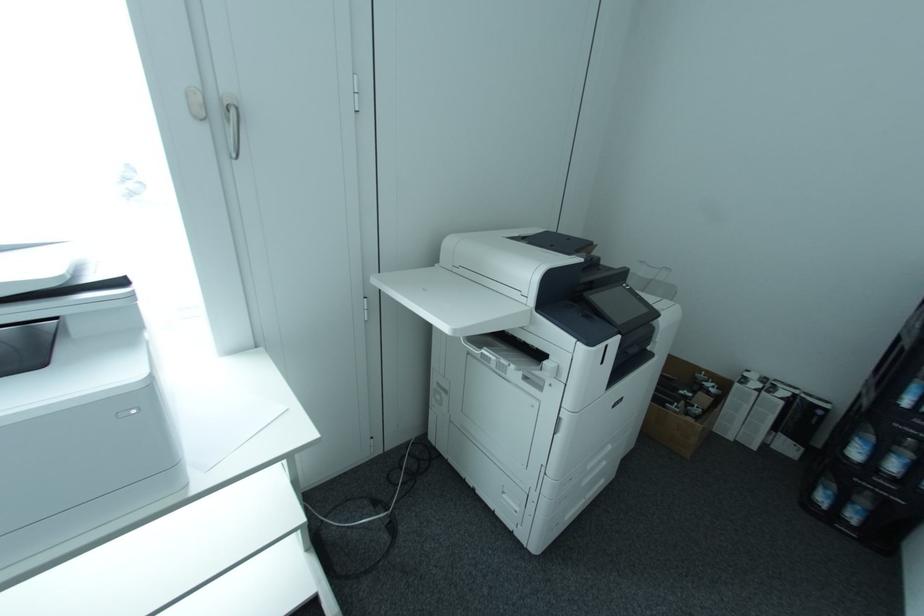
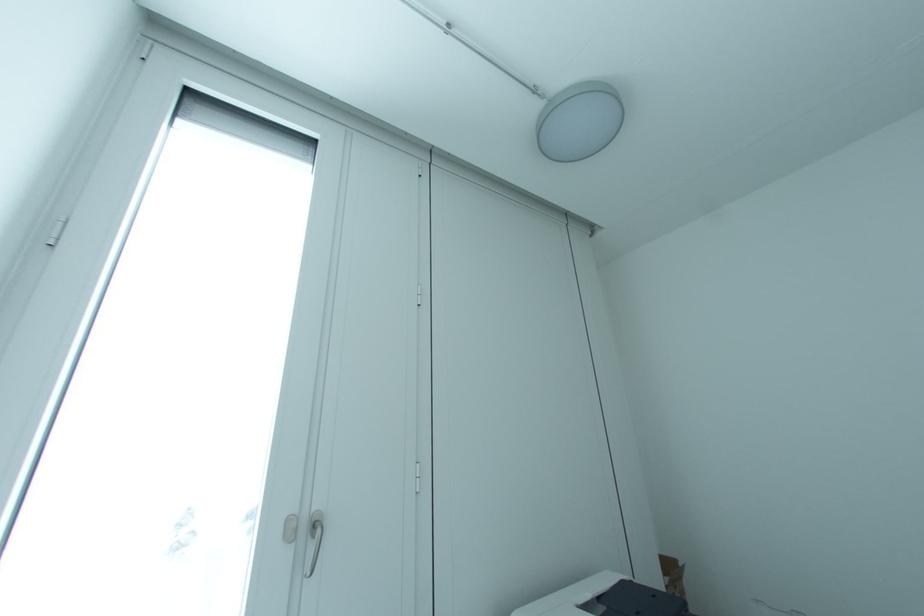
Question: How did the camera likely rotate?

Choices:
 (A) Left
 (B) Right
 (C) Up
 (D) Down

Answer: (C)